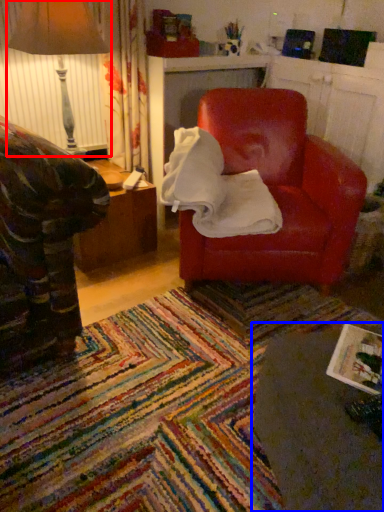
Question: Among these objects, which one is nearest to the camera, table lamp (highlighted by a red box) or table (highlighted by a blue box)?

Choices:
 (A) table lamp
 (B) table

Answer: (B)